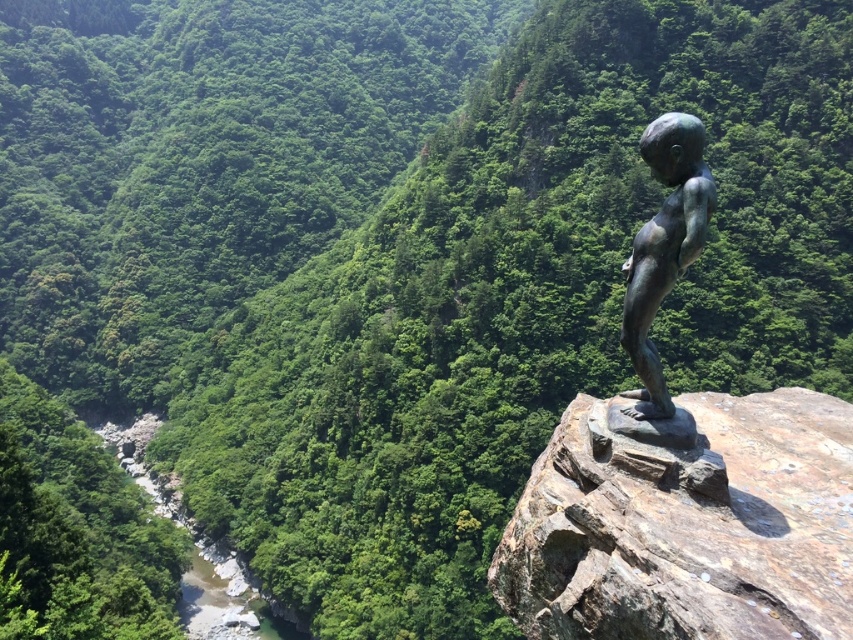
Question: Is rusty metallic statue at upper right to the left of bronze statue at center from the viewer's perspective?

Choices:
 (A) no
 (B) yes

Answer: (B)

Question: Which point is closer to the camera taking this photo?

Choices:
 (A) (706, 426)
 (B) (703, 136)

Answer: (B)

Question: Which point appears farthest from the camera in this image?

Choices:
 (A) (653, 131)
 (B) (550, 515)

Answer: (B)

Question: Can you confirm if rusty metallic statue at upper right is thinner than bronze statue at center?

Choices:
 (A) yes
 (B) no

Answer: (A)

Question: From the image, what is the correct spatial relationship of rusty metallic statue at upper right in relation to bronze statue at center?

Choices:
 (A) above
 (B) below

Answer: (B)

Question: Which point is farther to the camera?

Choices:
 (A) (529, 637)
 (B) (698, 152)

Answer: (A)